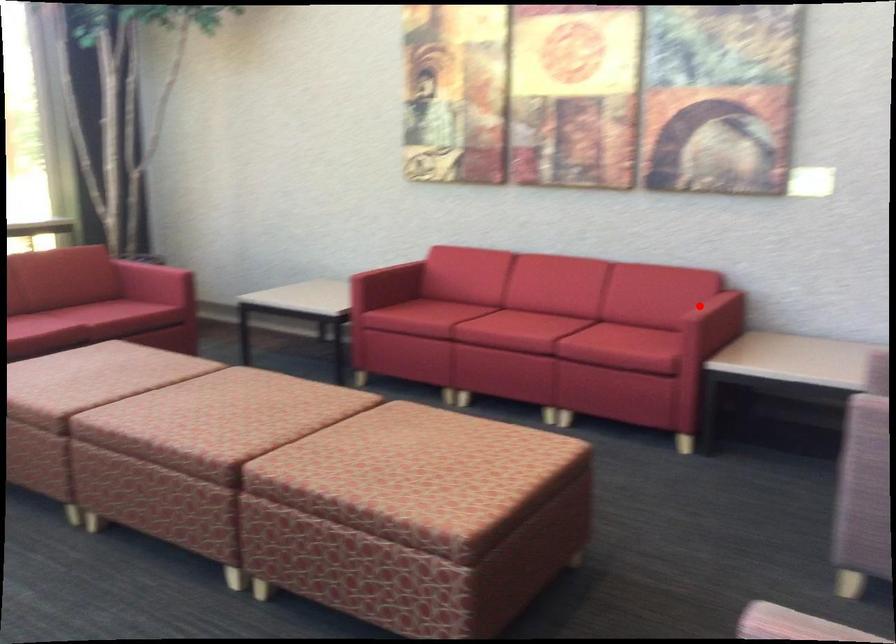
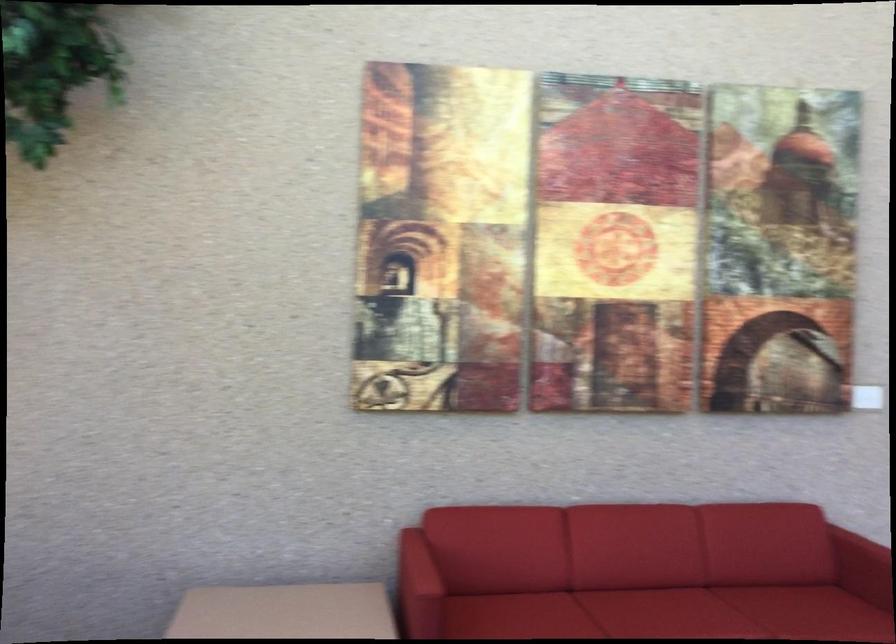
In the second image, find the point that corresponds to the highlighted location in the first image.

(864, 558)